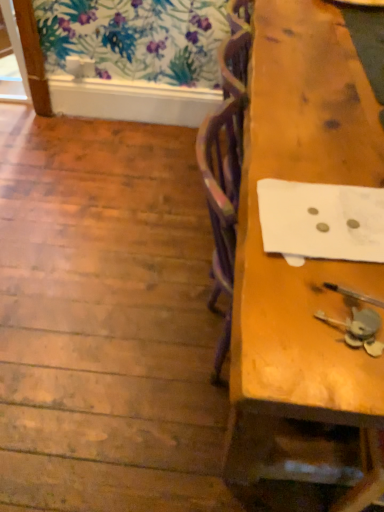
Where is `free point above wooden table at right (from a real-world perspective)`? The height and width of the screenshot is (512, 384). free point above wooden table at right (from a real-world perspective) is located at coordinates click(x=311, y=147).